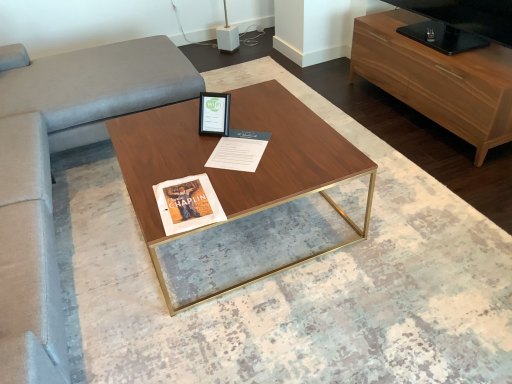
This screenshot has height=384, width=512. Find the location of `vacant area that is in front of walnut wood coffee table at center`. vacant area that is in front of walnut wood coffee table at center is located at coordinates (264, 324).